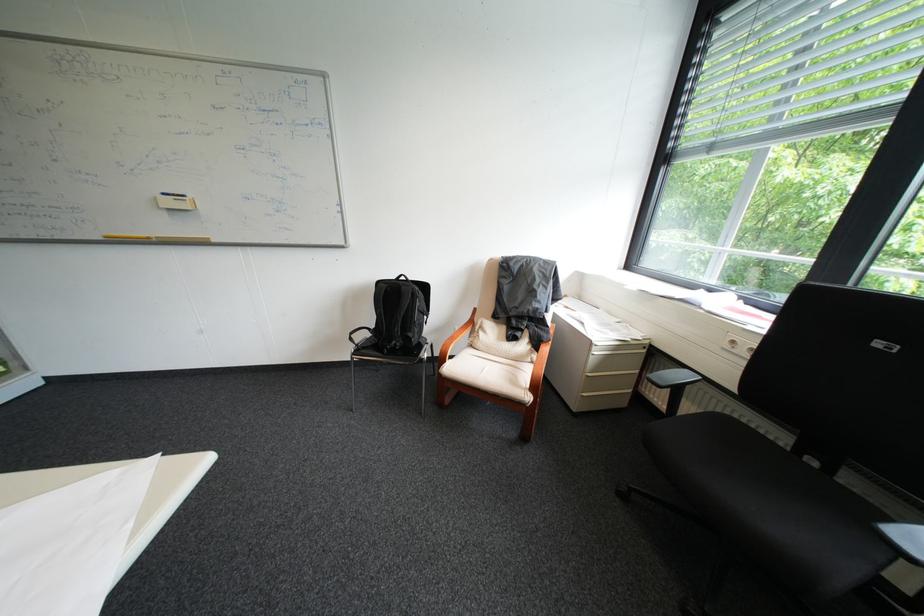
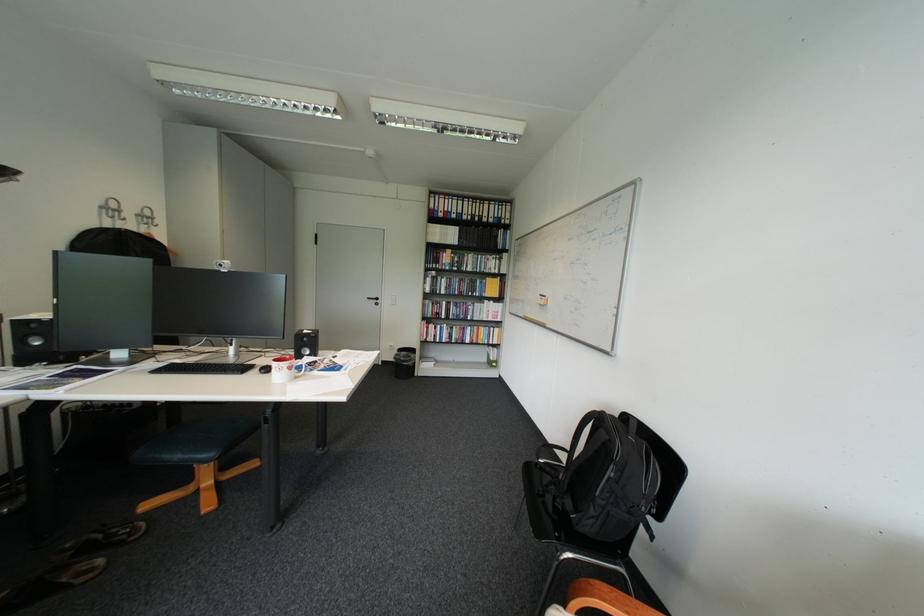
Find the pixel in the second image that matches pixel 427 322 in the first image.

(608, 496)